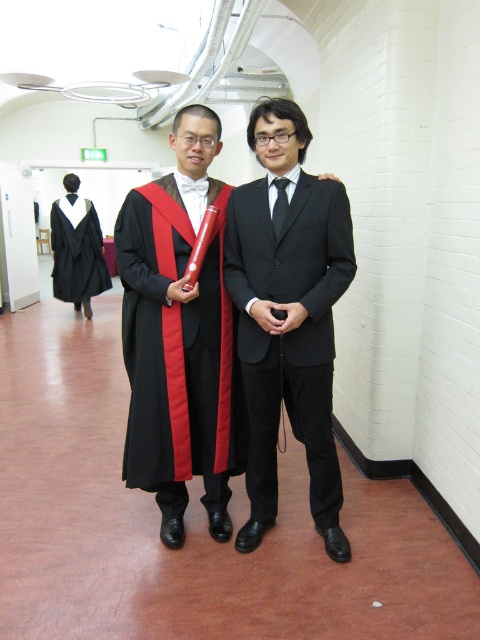
You are an event planner arranging seating for the ceremony. You need to ensure that the black satin suit at center and the matte black graduation gown at center can sit comfortably in chairs with a standard height of 45 cm. Given their heights, which one might require a footrest to reach the floor?

The matte black graduation gown at center is shorter than the black satin suit at center. Since the black satin suit at center has greater height, the person wearing it may need a footrest to reach the floor if their legs can not comfortably touch the ground.

You are an event planner arranging the seating for the graduation ceremony. You need to place the black satin suit at center and the matte black graduation gown at center in a row. Based on their positions in the image, which one should be seated closer to the stage?

The black satin suit at center is in front of the matte black graduation gown at center, so the black satin suit at center should be seated closer to the stage since it is positioned closer to the front in the image.